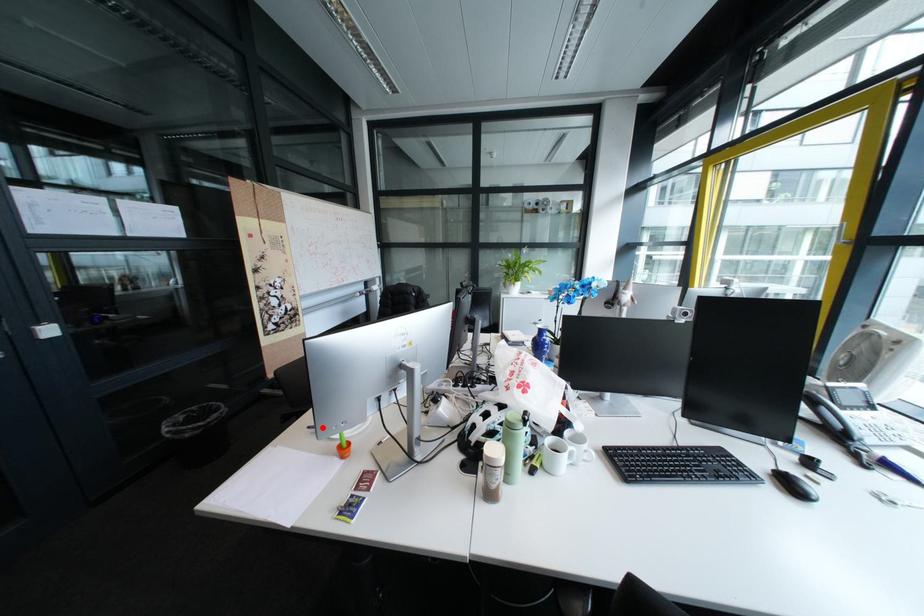
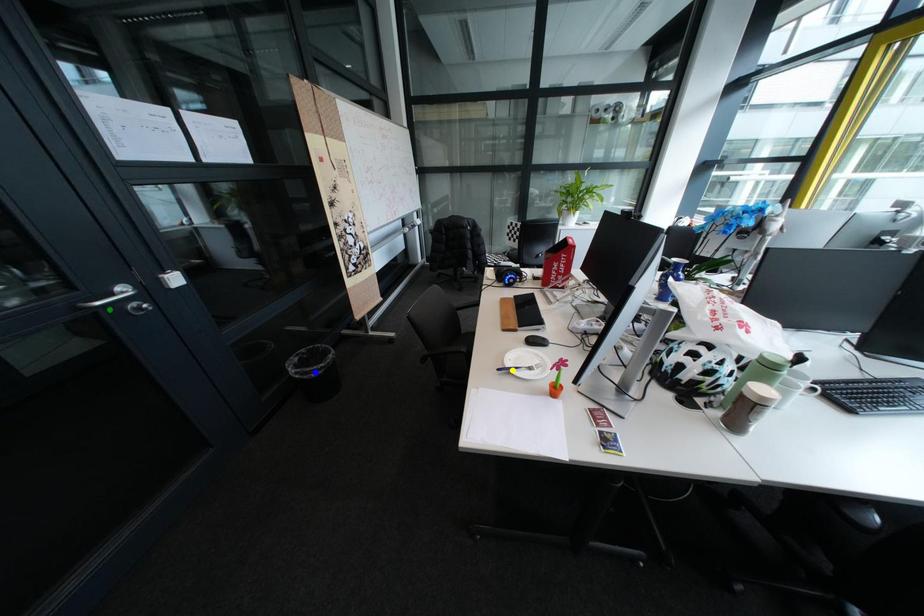
Question: I am providing you with two images of the same scene from different viewpoints. A red point is marked on the first image. You are given multiple points on the second image. Can you choose the point in image 2 that corresponds to the point in image 1?

Choices:
 (A) yellow point
 (B) blue point
 (C) green point

Answer: (A)